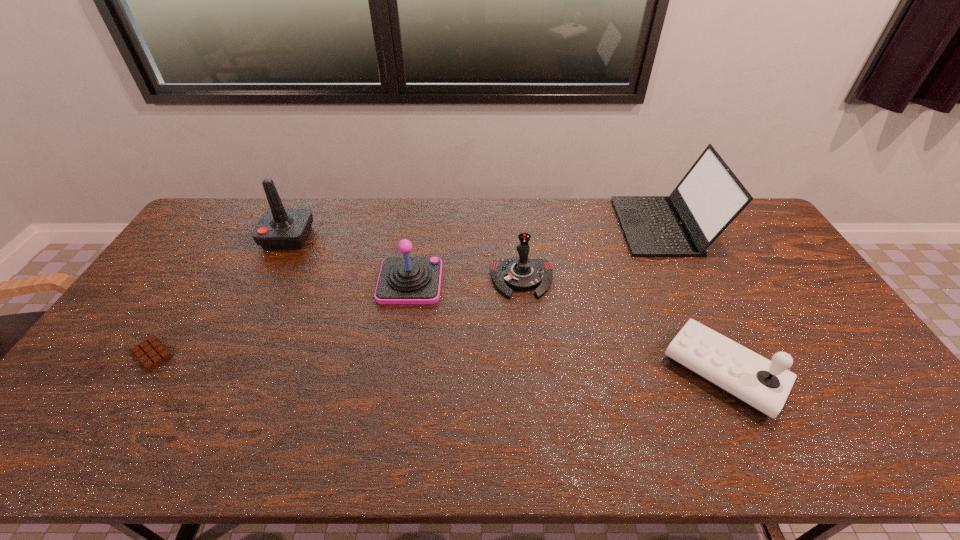
Where is `vacant region at the far edge of the desktop`? vacant region at the far edge of the desktop is located at coordinates (x=369, y=202).

In the image, there is a desktop. What are the coordinates of `vacant space at the near edge` in the screenshot? It's located at (776, 438).

Where is `free space at the left edge of the desktop`? Image resolution: width=960 pixels, height=540 pixels. free space at the left edge of the desktop is located at coordinates (194, 253).

Locate an element on the screen. Image resolution: width=960 pixels, height=540 pixels. blank area at the right edge is located at coordinates (843, 355).

In order to click on empty space that is in between the shortest object and the farthest joystick in this screenshot , I will do `click(220, 296)`.

The width and height of the screenshot is (960, 540). What are the coordinates of `empty location between the laptop and the fifth object from right to left` in the screenshot? It's located at (475, 232).

In order to click on vacant area between the candy bar and the fourth object from right to left in this screenshot , I will do `click(281, 318)`.

This screenshot has height=540, width=960. I want to click on vacant space that's between the tallest joystick and the fourth object from right to left, so click(349, 260).

This screenshot has width=960, height=540. Find the location of `free space between the third object from right to left and the rightmost joystick`. free space between the third object from right to left and the rightmost joystick is located at coordinates 623,326.

Where is `free space between the third joystick from right to left and the candy bar`? The image size is (960, 540). free space between the third joystick from right to left and the candy bar is located at coordinates [281, 318].